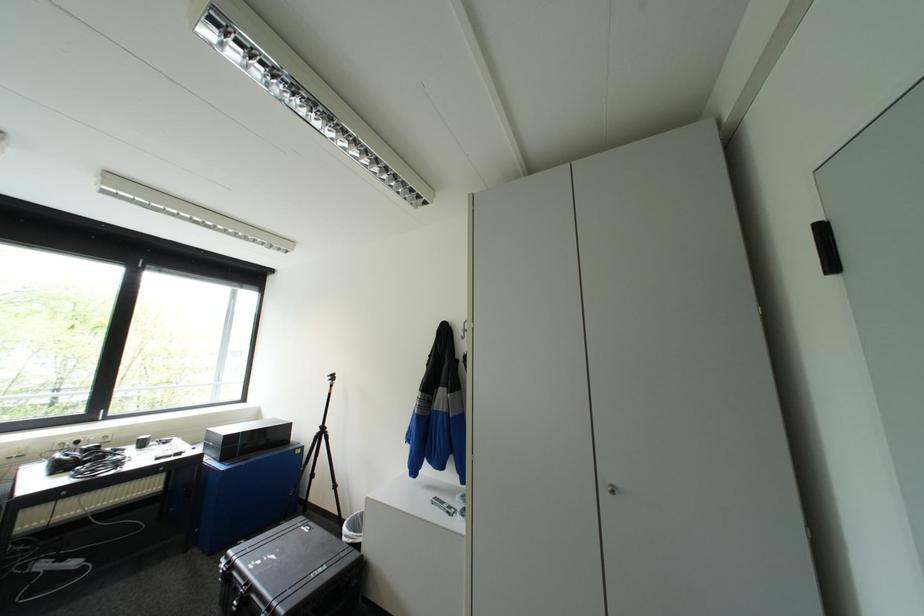
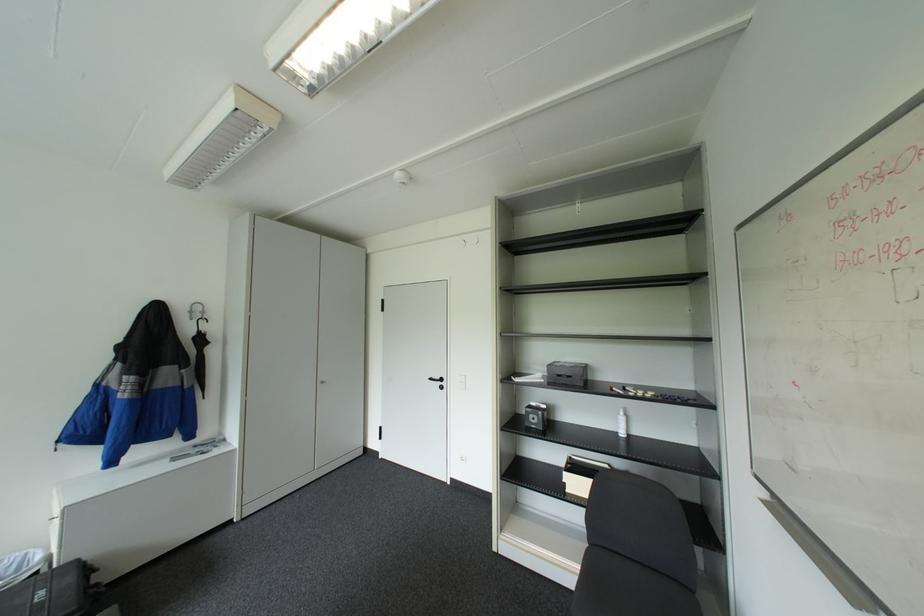
In the second image, find the point that corresponds to [470,337] in the first image.

(200, 318)